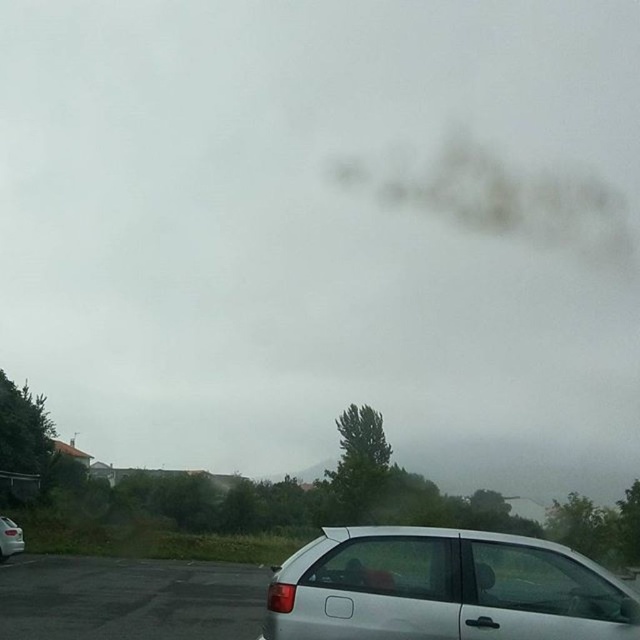
You are driving a car and want to park behind the silver metallic hatchback at lower center. Your car is 15 feet long. Is there enough space to park your car behind it without moving the hatchback?

The silver metallic hatchback at lower center is 20.04 feet from the camera. Since your car is 15 feet long, there is sufficient space to park behind it as the distance exceeds the length of your vehicle.

You are sitting in the front passenger seat of a car and looking out the window. You see the black asphalt parking lot at lower left and the silver metallic car at lower left. Which object is located to the right of the other?

The black asphalt parking lot at lower left is positioned on the right side of silver metallic car at lower left, so the black asphalt parking lot at lower left is to the right of the silver metallic car at lower left.

You are driving a car and want to park it in a parking spot that is 2 meters wide. The parking spot is located where the silver metallic hatchback at lower center is currently parked. Can you safely park your car in this spot without hitting the surrounding vehicles?

The silver metallic hatchback at lower center is parked at point coordinates (444,588), but without knowing the exact dimensions of the parking spot and the distance between surrounding vehicles, it is impossible to determine if your car can safely park there. Please check the actual space before proceeding.